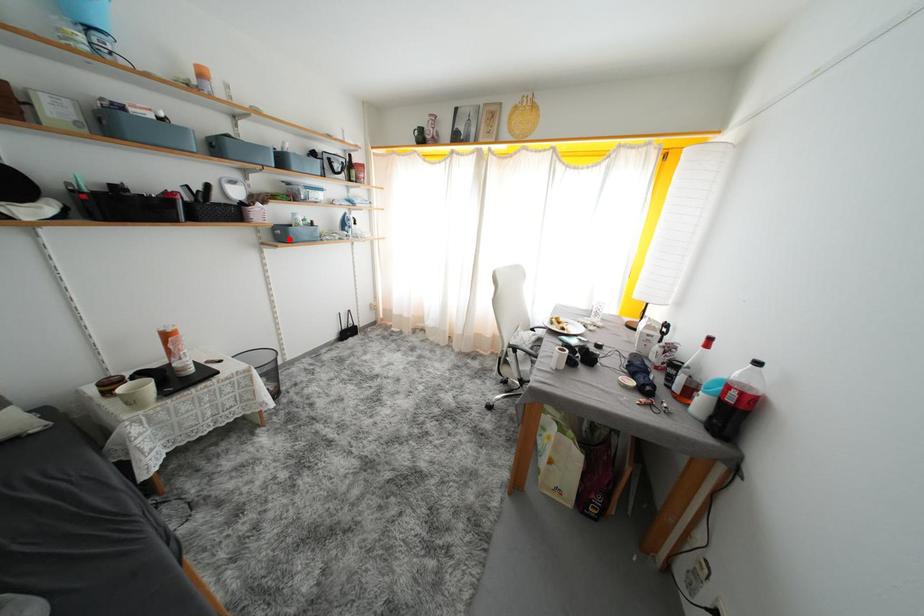
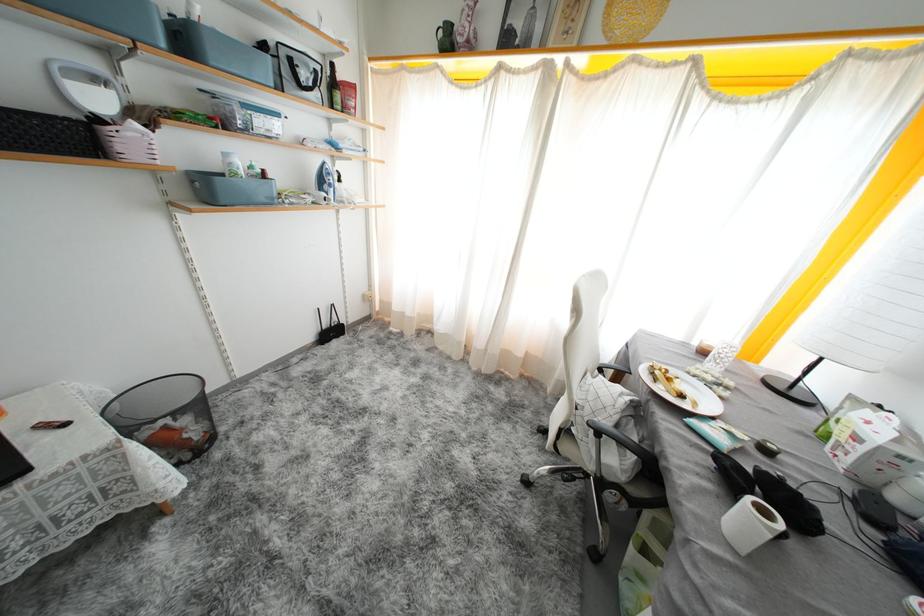
Where in the second image is the point corresponding to the highlighted location from the first image?

(215, 196)